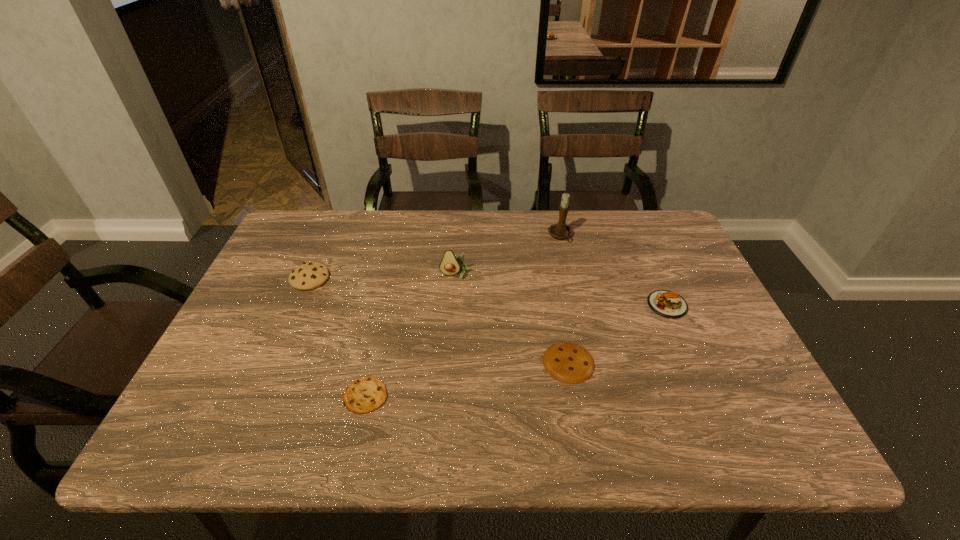
I want to click on free space between the second object from left to right and the patty (food), so click(516, 350).

Identify the location of vacant space that is in between the leftmost cookie and the fifth object from right to left. (338, 337).

Image resolution: width=960 pixels, height=540 pixels. What are the coordinates of `free spot between the second tallest object and the leftmost object` in the screenshot? It's located at (383, 277).

Where is `free space between the tallest object and the second object from left to right`? free space between the tallest object and the second object from left to right is located at coordinates (464, 316).

You are a GUI agent. You are given a task and a screenshot of the screen. Output one action in this format:
    pyautogui.click(x=<x>, y=<y>)
    Task: Click on the vacant space that is in between the candle holder and the third object from left to right
    This screenshot has height=540, width=960.
    Given the screenshot: What is the action you would take?
    pyautogui.click(x=509, y=255)

Identify the location of object that ranks as the closest to the leftmost cookie. (366, 394).

The height and width of the screenshot is (540, 960). What are the coordinates of `object that stands as the second closest to the leftmost cookie` in the screenshot? It's located at (450, 265).

Choose which cookie is the second nearest neighbor to the patty (food). Please provide its 2D coordinates. Your answer should be formatted as a tuple, i.e. [(x, y)], where the tuple contains the x and y coordinates of a point satisfying the conditions above.

[(366, 394)]

Identify which cookie is the second closest to the patty (food). Please provide its 2D coordinates. Your answer should be formatted as a tuple, i.e. [(x, y)], where the tuple contains the x and y coordinates of a point satisfying the conditions above.

[(366, 394)]

Locate an element on the screen. The width and height of the screenshot is (960, 540). vacant area in the image that satisfies the following two spatial constraints: 1. on the back side of the second cookie from right to left; 2. on the left side of the rightmost object is located at coordinates (386, 305).